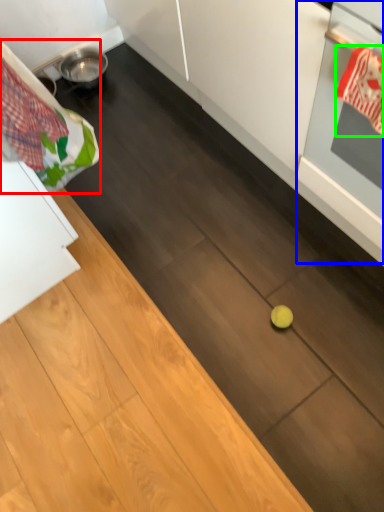
Question: Estimate the real-world distances between objects in this image. Which object is farther from laundry (highlighted by a red box), oven (highlighted by a blue box) or material (highlighted by a green box)?

Choices:
 (A) oven
 (B) material

Answer: (B)